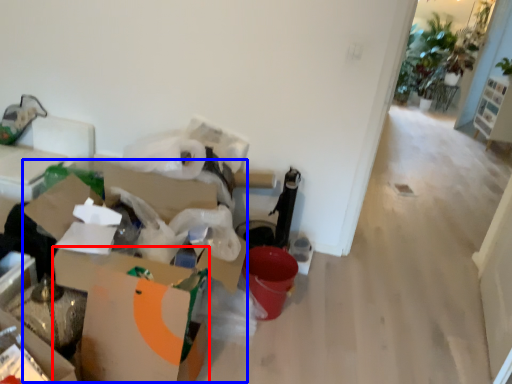
Question: Among these objects, which one is nearest to the camera, cardboard box (highlighted by a red box) or cardboard box (highlighted by a blue box)?

Choices:
 (A) cardboard box
 (B) cardboard box

Answer: (A)